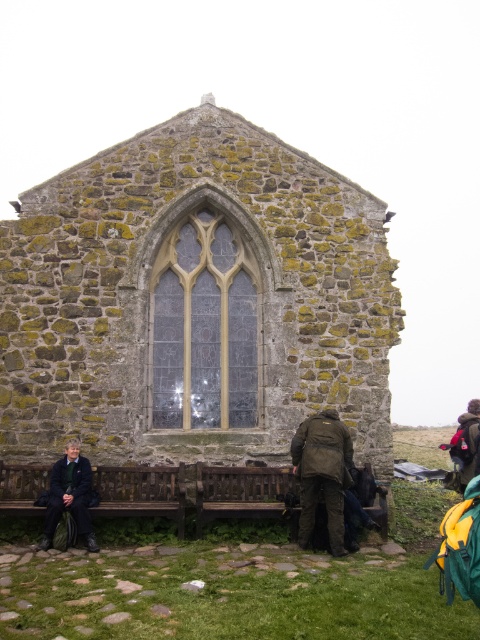
Does dark brown wooden bench at lower left have a smaller size compared to green fabric jacket at center?

Actually, dark brown wooden bench at lower left might be larger than green fabric jacket at center.

Can you confirm if dark brown wooden bench at lower left is wider than green fabric jacket at center?

Correct, the width of dark brown wooden bench at lower left exceeds that of green fabric jacket at center.

Identify the location of dark brown wooden bench at lower left. This screenshot has width=480, height=640. (141, 492).

Does point (370, 472) come behind point (80, 483)?

Yes, it is.

Is point (228, 499) closer to camera compared to point (44, 548)?

No, it is not.

Find the location of a particular element. Image resolution: width=480 pixels, height=640 pixels. wooden bench at center is located at coordinates (245, 493).

Does wooden bench at center have a larger size compared to green fabric jacket at center?

Indeed, wooden bench at center has a larger size compared to green fabric jacket at center.

Does wooden bench at center appear over green fabric jacket at center?

Incorrect, wooden bench at center is not positioned above green fabric jacket at center.

This screenshot has width=480, height=640. What are the coordinates of `wooden bench at center` in the screenshot? It's located at (245, 493).

Identify the location of wooden bench at center. This screenshot has width=480, height=640. (245, 493).